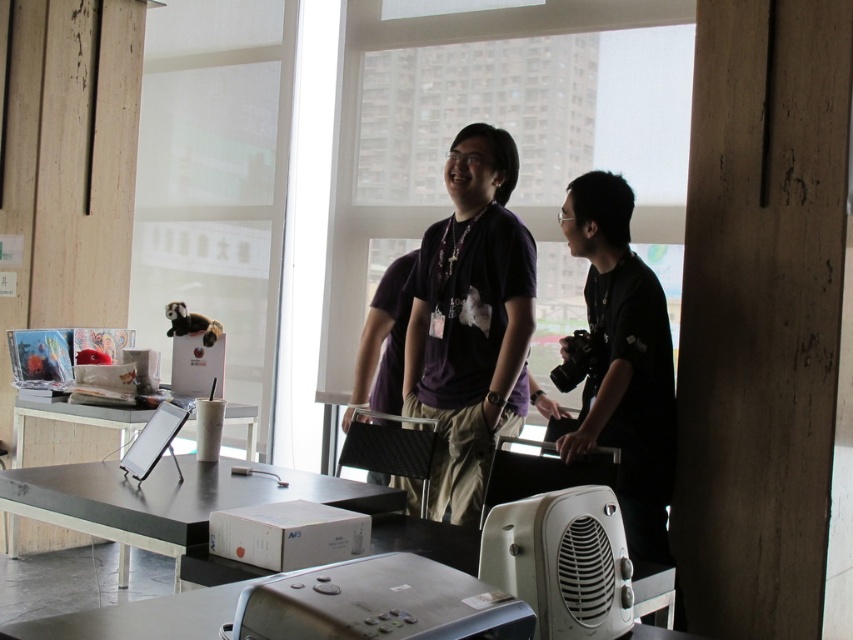
Question: Is black matte table at center below metallic gray projector at center?

Choices:
 (A) yes
 (B) no

Answer: (A)

Question: Which of the following is the closest to the observer?

Choices:
 (A) purple matte shirt at center
 (B) metallic gray projector at center
 (C) black matte table at center
 (D) black glossy tablet at center

Answer: (B)

Question: Which of the following is the closest to the observer?

Choices:
 (A) (409, 323)
 (B) (187, 477)

Answer: (B)

Question: Can you confirm if purple matte shirt at center is bigger than black glossy tablet at center?

Choices:
 (A) no
 (B) yes

Answer: (A)

Question: Which point appears farthest from the camera in this image?

Choices:
 (A) (502, 326)
 (B) (196, 541)
 (C) (30, 413)
 (D) (410, 586)

Answer: (C)

Question: Does metallic gray projector at center appear under black glossy tablet at center?

Choices:
 (A) no
 (B) yes

Answer: (A)